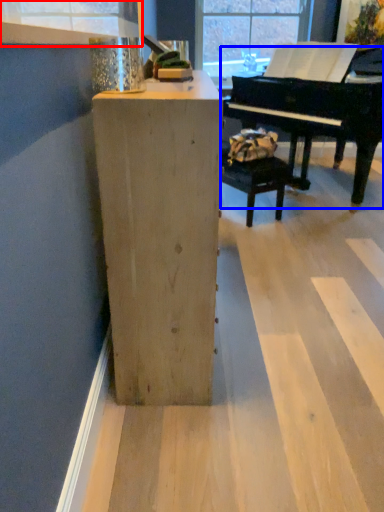
Question: Which object appears closest to the camera in this image, window frame (highlighted by a red box) or piano (highlighted by a blue box)?

Choices:
 (A) window frame
 (B) piano

Answer: (A)